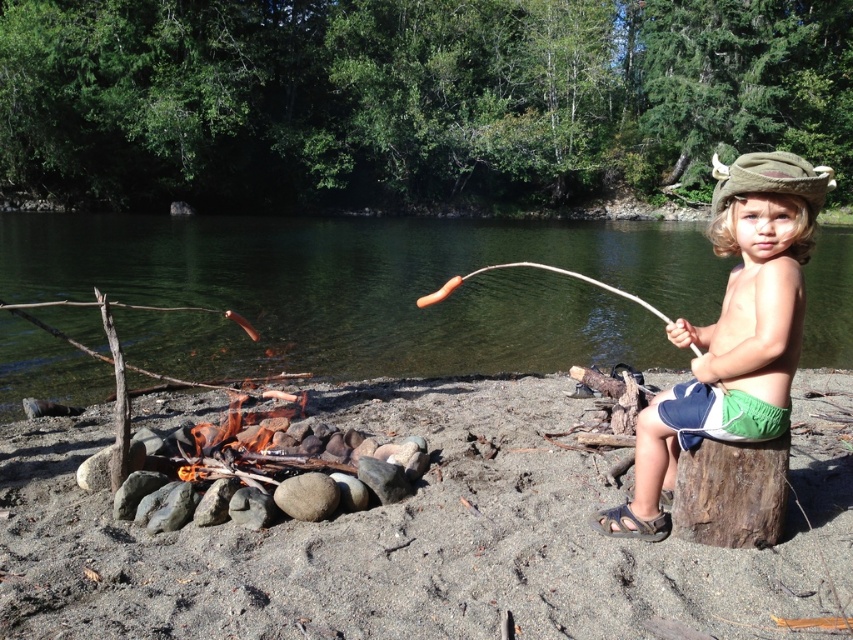
Question: Which object is farther from the camera taking this photo?

Choices:
 (A) green water at center
 (B) green fabric hat at right
 (C) pink rubber fish at lower left

Answer: (C)

Question: Which is farther from the brown rough tree trunk at lower right?

Choices:
 (A) smooth sand at lower center
 (B) green water at center

Answer: (B)

Question: Is smooth sand at lower center positioned behind green fabric hat at right?

Choices:
 (A) yes
 (B) no

Answer: (B)

Question: Among these objects, which one is nearest to the camera?

Choices:
 (A) smooth sand at lower center
 (B) green water at center
 (C) brown rough tree trunk at lower right
 (D) green fabric hat at right

Answer: (A)

Question: Can you confirm if green water at center is wider than green felt hat at upper right?

Choices:
 (A) yes
 (B) no

Answer: (A)

Question: Can you confirm if green fabric hat at right is positioned to the right of brown rough tree trunk at lower right?

Choices:
 (A) no
 (B) yes

Answer: (B)